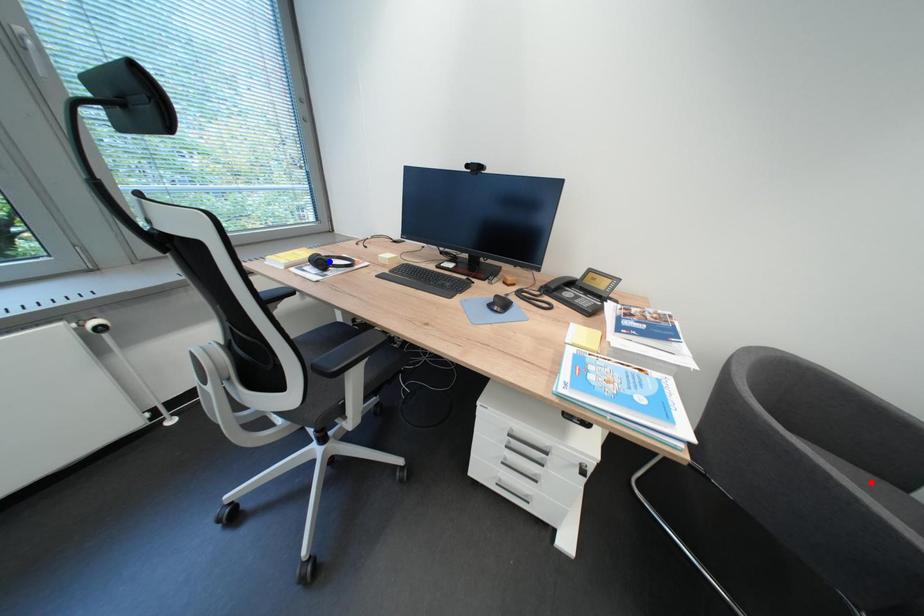
Question: In the image, two points are highlighted. Which point is nearer to the camera? Reply with the corresponding letter.

Choices:
 (A) blue point
 (B) red point

Answer: (B)